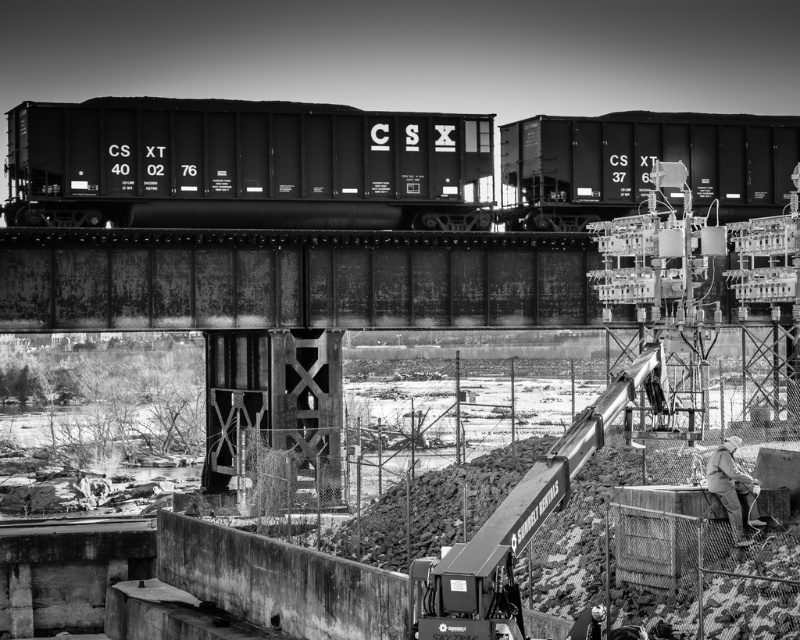
Does matte black train car at center appear on the right side of khaki fabric jacket at lower right?

In fact, matte black train car at center is to the left of khaki fabric jacket at lower right.

Does matte black train car at center appear under khaki fabric jacket at lower right?

Actually, matte black train car at center is above khaki fabric jacket at lower right.

Who is more forward, (x=352, y=192) or (x=742, y=516)?

Point (x=742, y=516) is more forward.

At what (x,y) coordinates should I click in order to perform the action: click on matte black train car at center. Please return your answer as a coordinate pair (x, y). The height and width of the screenshot is (640, 800). Looking at the image, I should click on (372, 164).

Does matte black train car at upper right appear on the right side of khaki fabric jacket at lower right?

Correct, you'll find matte black train car at upper right to the right of khaki fabric jacket at lower right.

Based on the photo, is matte black train car at upper right shorter than khaki fabric jacket at lower right?

Incorrect, matte black train car at upper right's height does not fall short of khaki fabric jacket at lower right's.

Is point (628, 160) behind point (733, 464)?

Yes, it is behind point (733, 464).

Where is `matte black train car at upper right`? This screenshot has height=640, width=800. matte black train car at upper right is located at coordinates (642, 164).

Can you confirm if matte black train car at center is shorter than matte black train car at upper right?

No.

Can you confirm if matte black train car at center is bigger than matte black train car at upper right?

Yes.

Is point (554, 228) closer to camera compared to point (786, 189)?

Yes, it is in front of point (786, 189).

Identify the location of matte black train car at center. The height and width of the screenshot is (640, 800). (372, 164).